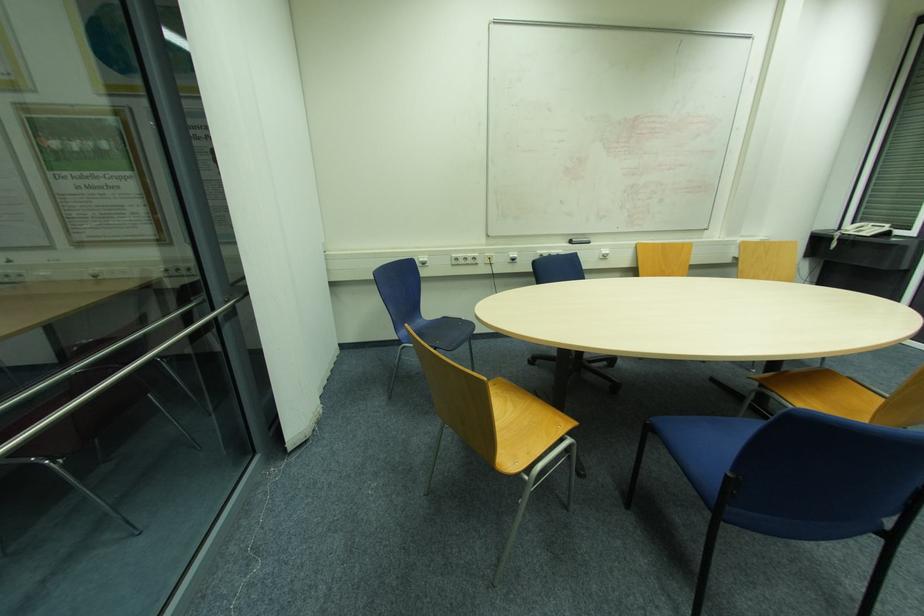
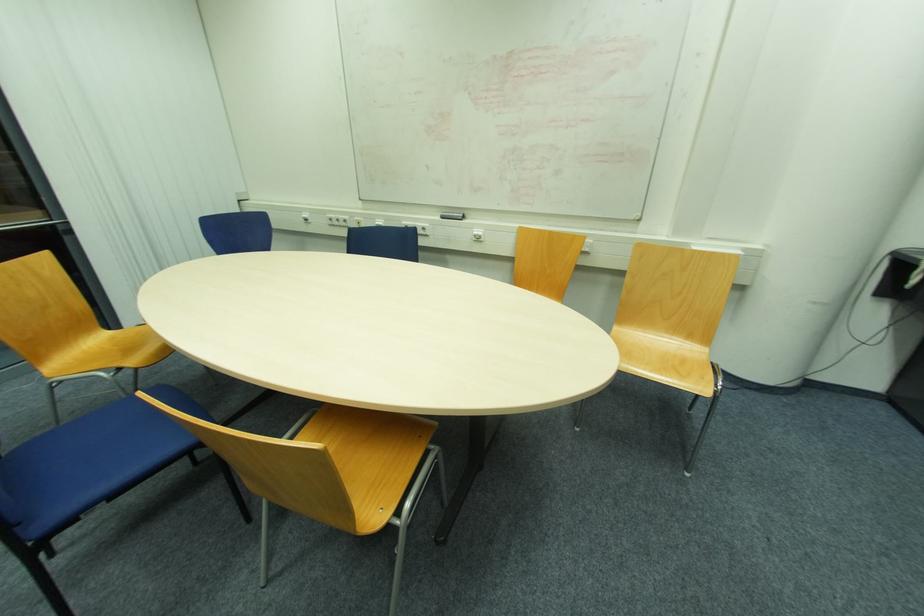
The point at (604,253) is marked in the first image. Where is the corresponding point in the second image?

(477, 233)